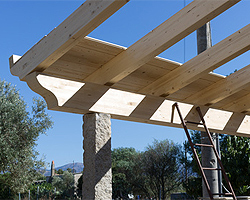
The image size is (250, 200). Identify the location of center-left beam. (167, 36).